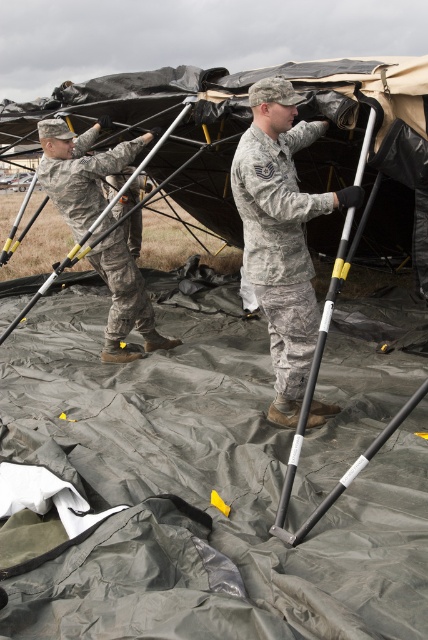
Question: Can you confirm if camouflage fabric uniform at center is bigger than camouflage fabric uniform at left?

Choices:
 (A) no
 (B) yes

Answer: (A)

Question: Is camouflage fabric uniform at center to the right of camouflage fabric uniform at left from the viewer's perspective?

Choices:
 (A) no
 (B) yes

Answer: (B)

Question: Which point appears farthest from the camera in this image?

Choices:
 (A) (86, 160)
 (B) (293, 289)

Answer: (A)

Question: Among these objects, which one is nearest to the camera?

Choices:
 (A) camouflage fabric uniform at left
 (B) camouflage fabric uniform at center

Answer: (B)

Question: Is camouflage fabric uniform at center positioned before camouflage fabric uniform at left?

Choices:
 (A) no
 (B) yes

Answer: (B)